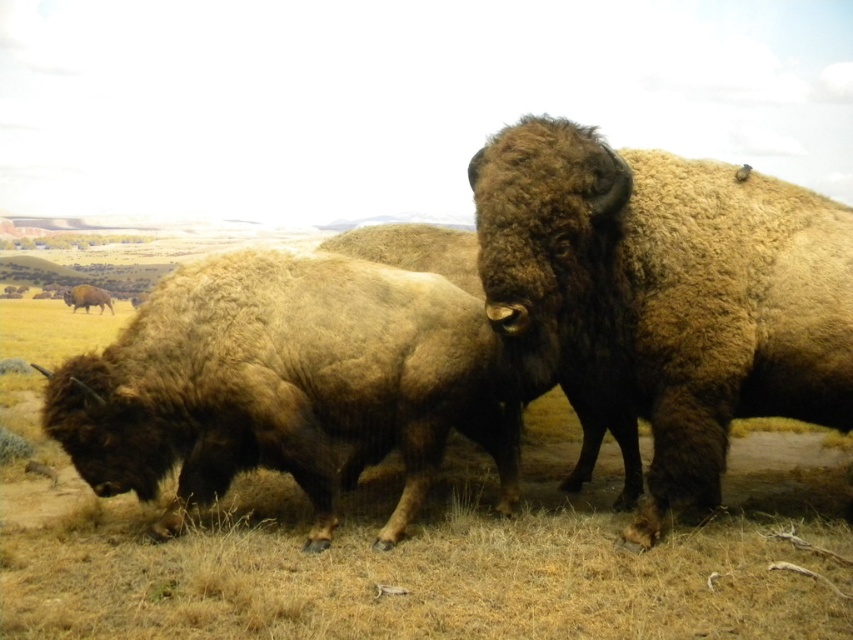
Does brown fuzzy bison at center have a larger size compared to brown fuzzy bison at lower left?

Correct, brown fuzzy bison at center is larger in size than brown fuzzy bison at lower left.

Is brown fuzzy bison at center to the right of brown fuzzy bison at lower left from the viewer's perspective?

Correct, you'll find brown fuzzy bison at center to the right of brown fuzzy bison at lower left.

Is point (636, 300) more distant than point (80, 291)?

No.

Where is `brown fuzzy bison at center`? The height and width of the screenshot is (640, 853). brown fuzzy bison at center is located at coordinates (666, 291).